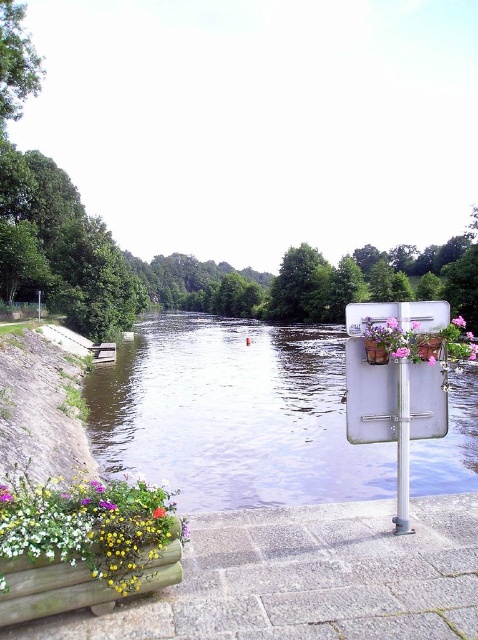
Is point (108, 493) less distant than point (412, 324)?

Yes, it is.

Is wooden planter at lower left below pink fabric flower at upper center?

Yes, wooden planter at lower left is below pink fabric flower at upper center.

Locate an element on the screen. wooden planter at lower left is located at coordinates (87, 525).

Find the location of `wooden planter at lower left`. wooden planter at lower left is located at coordinates (87, 525).

Who is lower down, granite paving stones at lower center or wooden planter at lower left?

granite paving stones at lower center

Is granite paving stones at lower center below wooden planter at lower left?

Yes.

Who is more forward, [321,627] or [138,490]?

Point [321,627] is in front.

At what (x,y) coordinates should I click in order to perform the action: click on granite paving stones at lower center. Please return your answer as a coordinate pair (x, y). Looking at the image, I should click on (306, 579).

Does clear water at center have a larger size compared to pink fabric flower at upper center?

Yes.

Locate an element on the screen. clear water at center is located at coordinates (232, 413).

Who is more distant from viewer, (132,461) or (412,324)?

The point (132,461) is behind.

Locate an element on the screen. Image resolution: width=478 pixels, height=640 pixels. clear water at center is located at coordinates (232, 413).